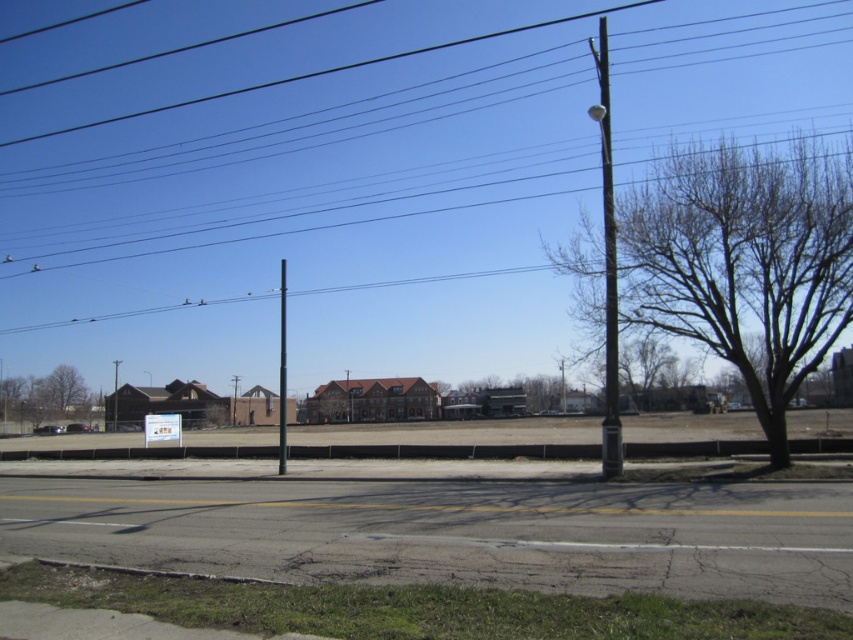
Does black wire at upper center appear on the left side of black metal pole at center?

No, black wire at upper center is not to the left of black metal pole at center.

Does black wire at upper center appear under black metal pole at center?

No.

Who is more forward, (425, 234) or (283, 467)?

Point (283, 467) is more forward.

Locate an element on the screen. This screenshot has width=853, height=640. black wire at upper center is located at coordinates (309, 193).

Who is lower down, bare brown tree at center or white plastic sign at center?

bare brown tree at center is lower down.

Does bare brown tree at center appear over white plastic sign at center?

Incorrect, bare brown tree at center is not positioned above white plastic sign at center.

Is point (544, 392) positioned after point (149, 422)?

Yes.

Where is `bare brown tree at center`? The height and width of the screenshot is (640, 853). bare brown tree at center is located at coordinates (509, 394).

Looking at this image, is bare wood tree at right above black metal pole at center?

Yes.

Is bare wood tree at right smaller than black metal pole at center?

No.

At what (x,y) coordinates should I click in order to perform the action: click on bare wood tree at right. Please return your answer as a coordinate pair (x, y). Image resolution: width=853 pixels, height=640 pixels. Looking at the image, I should click on (744, 262).